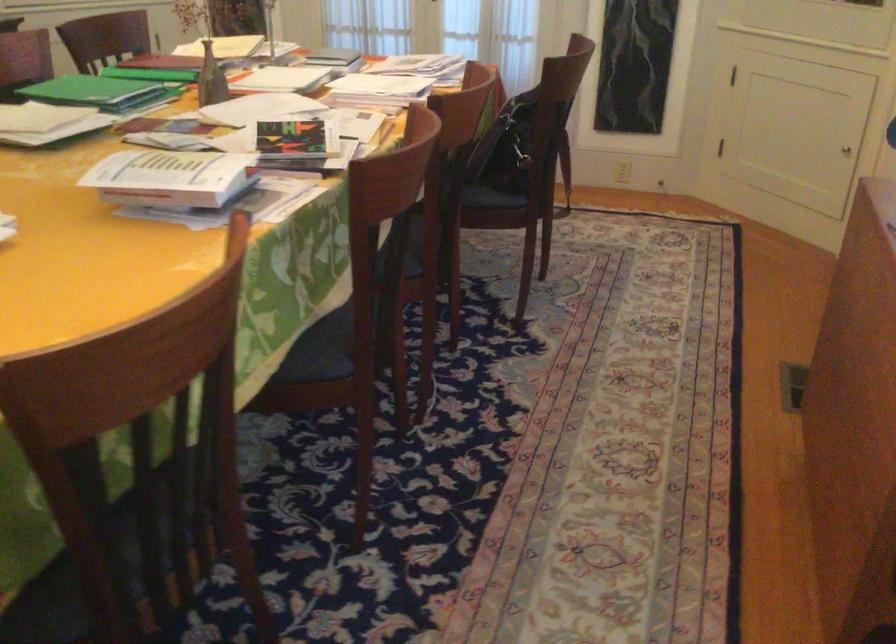
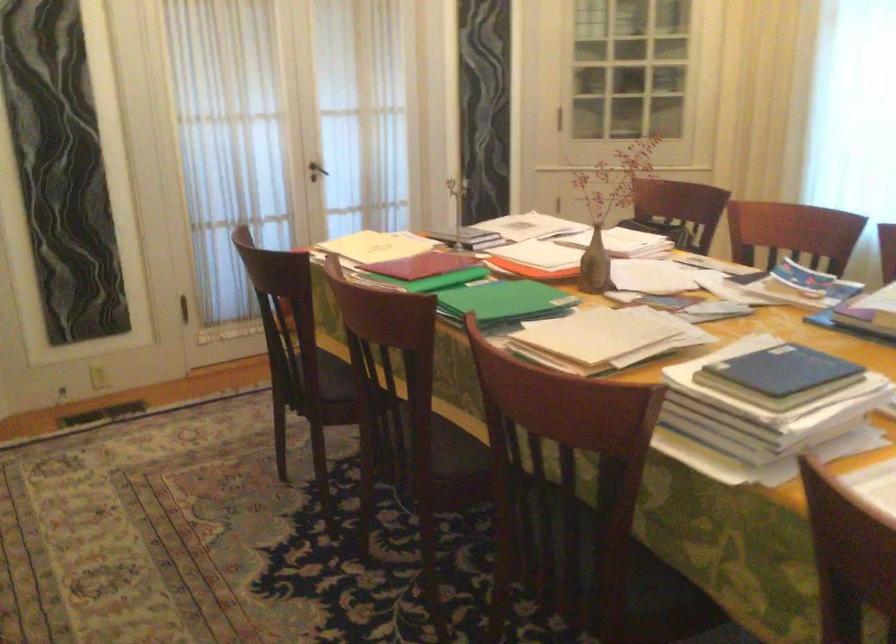
Find the pixel in the second image that matches point 75,75 in the first image.

(504, 301)